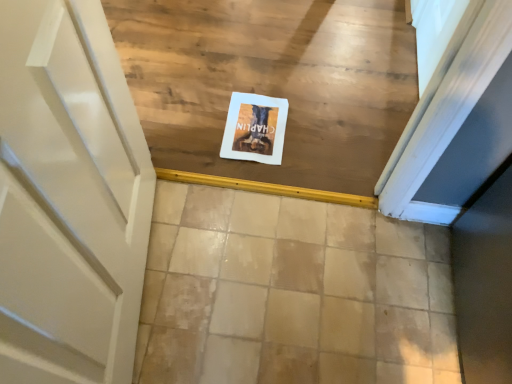
Image resolution: width=512 pixels, height=384 pixels. I want to click on free location above white paper at center (from a real-world perspective), so click(x=258, y=125).